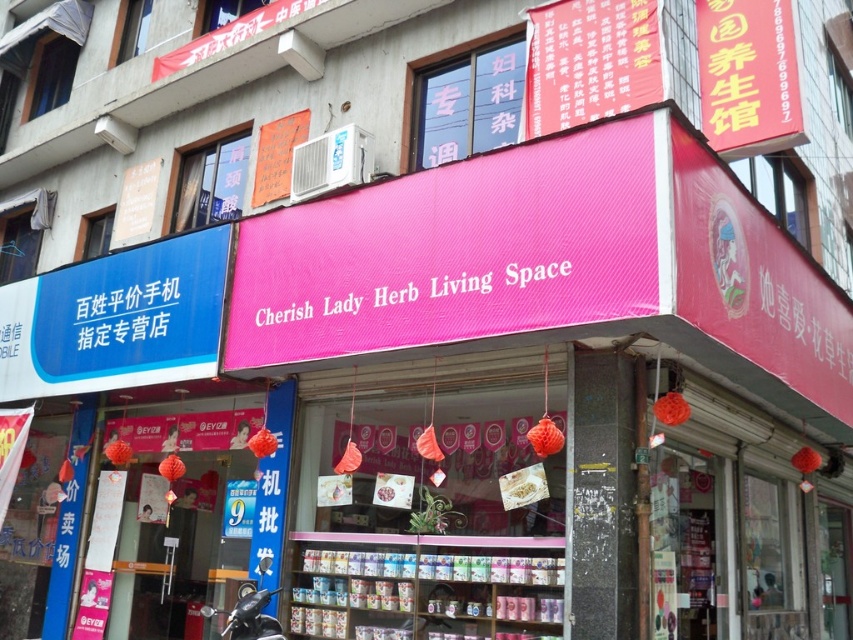
Question: Which of the following is the farthest from the observer?

Choices:
 (A) (325, 298)
 (B) (228, 625)

Answer: (A)

Question: Where is black matte motorcycle at lower left located in relation to whitetext on fabric cherish lady herb living space at center in the image?

Choices:
 (A) left
 (B) right

Answer: (A)

Question: Can you confirm if black matte motorcycle at lower left is wider than whitetext on fabric cherish lady herb living space at center?

Choices:
 (A) no
 (B) yes

Answer: (A)

Question: Which point is farther from the camera taking this photo?

Choices:
 (A) (276, 589)
 (B) (463, 273)

Answer: (A)

Question: Can you confirm if black matte motorcycle at lower left is thinner than whitetext on fabric cherish lady herb living space at center?

Choices:
 (A) no
 (B) yes

Answer: (B)

Question: Which point is closer to the camera?

Choices:
 (A) black matte motorcycle at lower left
 (B) whitetext on fabric cherish lady herb living space at center

Answer: (B)